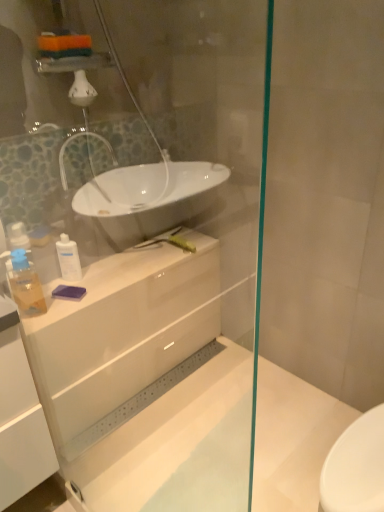
The width and height of the screenshot is (384, 512). What do you see at coordinates (128, 318) in the screenshot?
I see `white glossy cabinet at center` at bounding box center [128, 318].

The image size is (384, 512). Find the location of `white glossy cabinet at center`. white glossy cabinet at center is located at coordinates (128, 318).

What do you see at coordinates (146, 247) in the screenshot? This screenshot has width=384, height=512. I see `transparent glass shower door at upper center` at bounding box center [146, 247].

Locate an element on the screen. The image size is (384, 512). white glossy cabinet at center is located at coordinates (128, 318).

Is white glossy lotion at center, the second toiletry in the left-to-right sequence, inside the boundaries of white glossy cabinet at center, or outside?

white glossy lotion at center, the second toiletry in the left-to-right sequence, is located beyond the bounds of white glossy cabinet at center.

Is white glossy lotion at center, the second toiletry in the left-to-right sequence, in front of white glossy cabinet at center?

No, white glossy lotion at center, the second toiletry in the left-to-right sequence, is further to the viewer.

Is white glossy lotion at center, which is the 1th toiletry in right-to-left order, bigger or smaller than white glossy cabinet at center?

Clearly, white glossy lotion at center, which is the 1th toiletry in right-to-left order, is smaller in size than white glossy cabinet at center.

From a real-world perspective, is transparent glass shower door at upper center above or below white glossy lotion at center, the first toiletry in the back-to-front sequence?

transparent glass shower door at upper center is situated higher than white glossy lotion at center, the first toiletry in the back-to-front sequence, in the real world.

Is the depth of transparent glass shower door at upper center greater than that of white glossy lotion at center, the first toiletry in the back-to-front sequence?

No, transparent glass shower door at upper center is closer to the viewer.

What's the angular difference between transparent glass shower door at upper center and white glossy lotion at center, the second toiletry in the left-to-right sequence,'s facing directions?

122 degrees separate the facing orientations of transparent glass shower door at upper center and white glossy lotion at center, the second toiletry in the left-to-right sequence.

Is transparent glass shower door at upper center wider or thinner than white glossy lotion at center, the first toiletry in the back-to-front sequence?

Clearly, transparent glass shower door at upper center has less width compared to white glossy lotion at center, the first toiletry in the back-to-front sequence.

How far apart are translucent plastic soap dispenser at left, the 2th toiletry from the right, and transparent glass shower door at upper center?

translucent plastic soap dispenser at left, the 2th toiletry from the right, and transparent glass shower door at upper center are 20.93 inches apart from each other.

Which is further, [20,286] or [261,61]?

The point [261,61] is farther.

Which of these two, translucent plastic soap dispenser at left, the 1th toiletry viewed from the front, or transparent glass shower door at upper center, stands shorter?

translucent plastic soap dispenser at left, the 1th toiletry viewed from the front, is shorter.

Consider the image. From the image's perspective, is translucent plastic soap dispenser at left, acting as the first toiletry starting from the left, beneath transparent glass shower door at upper center?

Incorrect, from the image's perspective, translucent plastic soap dispenser at left, acting as the first toiletry starting from the left, is higher than transparent glass shower door at upper center.

From the picture: Is white glossy lotion at center, which is the 1th toiletry in right-to-left order, oriented towards transparent glass shower door at upper center?

Yes, white glossy lotion at center, which is the 1th toiletry in right-to-left order, faces towards transparent glass shower door at upper center.

Identify the location of toiletry that is the 2nd object directly below the transparent glass shower door at upper center (from a real-world perspective). (68, 258).

Would you say white glossy lotion at center, the second toiletry in the left-to-right sequence, contains transparent glass shower door at upper center?

No, transparent glass shower door at upper center is located outside of white glossy lotion at center, the second toiletry in the left-to-right sequence.

From the image's perspective, is translucent plastic soap dispenser at left, acting as the first toiletry starting from the left, positioned above or below white glossy lotion at center, which is the 1th toiletry in right-to-left order?

translucent plastic soap dispenser at left, acting as the first toiletry starting from the left, is situated lower than white glossy lotion at center, which is the 1th toiletry in right-to-left order, in the image.

From a real-world perspective, relative to white glossy lotion at center, the 2th toiletry positioned from the front, is translucent plastic soap dispenser at left, acting as the first toiletry starting from the left, vertically above or below?

In terms of real-world spatial position, translucent plastic soap dispenser at left, acting as the first toiletry starting from the left, is above white glossy lotion at center, the 2th toiletry positioned from the front.

Do you think transparent glass shower door at upper center is within white glossy cabinet at center, or outside of it?

transparent glass shower door at upper center is not enclosed by white glossy cabinet at center.

From a real-world perspective, is transparent glass shower door at upper center located beneath white glossy cabinet at center?

No, from a real-world perspective, transparent glass shower door at upper center is not below white glossy cabinet at center.

Is the depth of transparent glass shower door at upper center less than that of white glossy cabinet at center?

Yes, transparent glass shower door at upper center is closer to the camera.

Locate an element on the screen. The image size is (384, 512). counter top above the transparent glass shower door at upper center (from the image's perspective) is located at coordinates point(128,318).

In terms of width, does white glossy cabinet at center look wider or thinner when compared to translucent plastic soap dispenser at left, acting as the first toiletry starting from the left?

In the image, white glossy cabinet at center appears to be wider than translucent plastic soap dispenser at left, acting as the first toiletry starting from the left.

How distant is white glossy cabinet at center from translucent plastic soap dispenser at left, marked as the 2th toiletry in a back-to-front arrangement?

white glossy cabinet at center is 15.33 inches away from translucent plastic soap dispenser at left, marked as the 2th toiletry in a back-to-front arrangement.

At what (x,y) coordinates should I click in order to perform the action: click on toiletry below the white glossy cabinet at center (from the image's perspective). Please return your answer as a coordinate pair (x, y). This screenshot has height=512, width=384. Looking at the image, I should click on (25, 284).

Does white glossy cabinet at center appear on the left side of translucent plastic soap dispenser at left, the 2th toiletry from the right?

In fact, white glossy cabinet at center is to the right of translucent plastic soap dispenser at left, the 2th toiletry from the right.

The image size is (384, 512). In order to click on counter top that appears below the white glossy lotion at center, the second toiletry in the left-to-right sequence (from a real-world perspective) in this screenshot , I will do `click(128, 318)`.

The image size is (384, 512). I want to click on shower door above the white glossy lotion at center, the first toiletry in the back-to-front sequence (from a real-world perspective), so click(146, 247).

Which object lies further to the anchor point translucent plastic soap dispenser at left, the 1th toiletry viewed from the front, white glossy lotion at center, the second toiletry in the left-to-right sequence, or transparent glass shower door at upper center?

transparent glass shower door at upper center is positioned further to the anchor translucent plastic soap dispenser at left, the 1th toiletry viewed from the front.

In the scene shown: Looking at the image, which one is located further to transparent glass shower door at upper center, white glossy lotion at center, the first toiletry in the back-to-front sequence, or translucent plastic soap dispenser at left, acting as the first toiletry starting from the left?

Among the two, translucent plastic soap dispenser at left, acting as the first toiletry starting from the left, is located further to transparent glass shower door at upper center.

Which object lies further to the anchor point translucent plastic soap dispenser at left, the 2th toiletry from the right, transparent glass shower door at upper center or white glossy lotion at center, the 2th toiletry positioned from the front?

The object further to translucent plastic soap dispenser at left, the 2th toiletry from the right, is transparent glass shower door at upper center.

Which object lies further to the anchor point translucent plastic soap dispenser at left, marked as the 2th toiletry in a back-to-front arrangement, white glossy cabinet at center or white glossy lotion at center, which is the 1th toiletry in right-to-left order?

Among the two, white glossy cabinet at center is located further to translucent plastic soap dispenser at left, marked as the 2th toiletry in a back-to-front arrangement.

Which object lies nearer to the anchor point white glossy cabinet at center, translucent plastic soap dispenser at left, the 1th toiletry viewed from the front, or transparent glass shower door at upper center?

transparent glass shower door at upper center is closer to white glossy cabinet at center.

Considering their positions, is translucent plastic soap dispenser at left, marked as the 2th toiletry in a back-to-front arrangement, positioned closer to transparent glass shower door at upper center than white glossy cabinet at center?

white glossy cabinet at center lies closer to transparent glass shower door at upper center than the other object.

From the image, which object appears to be nearer to transparent glass shower door at upper center, translucent plastic soap dispenser at left, the 1th toiletry viewed from the front, or white glossy lotion at center, the first toiletry in the back-to-front sequence?

Among the two, white glossy lotion at center, the first toiletry in the back-to-front sequence, is located nearer to transparent glass shower door at upper center.

Estimate the real-world distances between objects in this image. Which object is further from white glossy lotion at center, which is the 1th toiletry in right-to-left order, translucent plastic soap dispenser at left, acting as the first toiletry starting from the left, or white glossy cabinet at center?

white glossy cabinet at center.

Image resolution: width=384 pixels, height=512 pixels. I want to click on toiletry located between transparent glass shower door at upper center and white glossy lotion at center, which is the 1th toiletry in right-to-left order, in the depth direction, so click(x=25, y=284).

I want to click on counter top located between transparent glass shower door at upper center and white glossy lotion at center, which is the 1th toiletry in right-to-left order, in the depth direction, so click(128, 318).

At what (x,y) coordinates should I click in order to perform the action: click on toiletry positioned between transparent glass shower door at upper center and white glossy cabinet at center from near to far. Please return your answer as a coordinate pair (x, y). Image resolution: width=384 pixels, height=512 pixels. Looking at the image, I should click on (25, 284).

Identify the location of toiletry between translucent plastic soap dispenser at left, the 1th toiletry viewed from the front, and white glossy cabinet at center from left to right. Image resolution: width=384 pixels, height=512 pixels. (68, 258).